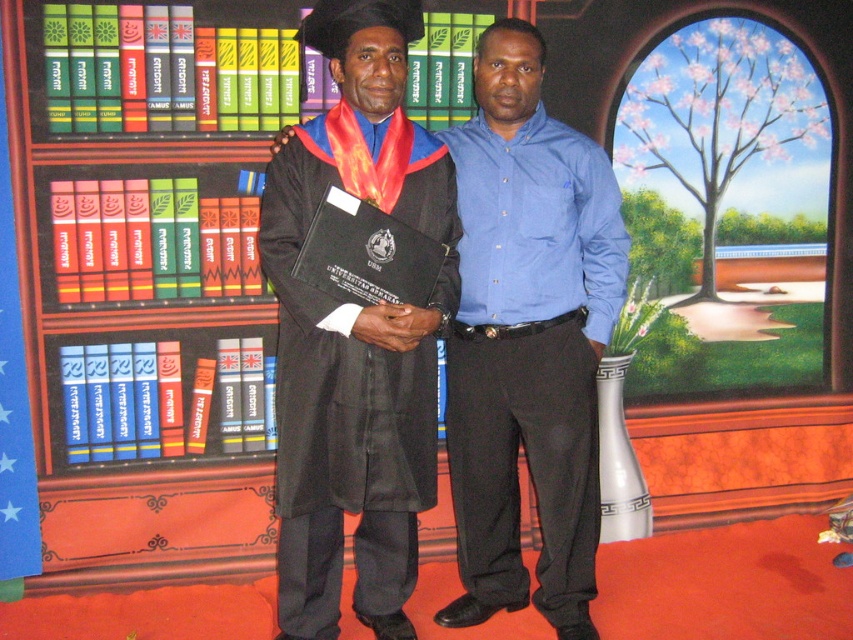
Which is above, matte black graduation gown at center or black matte graduation gown at center?

Positioned higher is matte black graduation gown at center.

Who is shorter, matte black graduation gown at center or black matte graduation gown at center?

black matte graduation gown at center is shorter.

Is point (532, 451) behind point (279, 540)?

Yes.

Identify the location of matte black graduation gown at center. (527, 339).

Does wooden bookcase at left have a greater width compared to matte black graduation gown at center?

Correct, the width of wooden bookcase at left exceeds that of matte black graduation gown at center.

Can you confirm if wooden bookcase at left is thinner than matte black graduation gown at center?

In fact, wooden bookcase at left might be wider than matte black graduation gown at center.

Is point (114, 298) farther from viewer compared to point (564, 234)?

Yes, point (114, 298) is behind point (564, 234).

Identify the location of wooden bookcase at left. (134, 348).

Between matte black robe at center and black matte graduation gown at center, which one has more height?

matte black robe at center is taller.

Is the position of matte black robe at center more distant than that of black matte graduation gown at center?

Yes.

Between point (486, 529) and point (376, 193), which one is positioned behind?

The point (486, 529) is behind.

Find the location of a particular element. matte black robe at center is located at coordinates (531, 355).